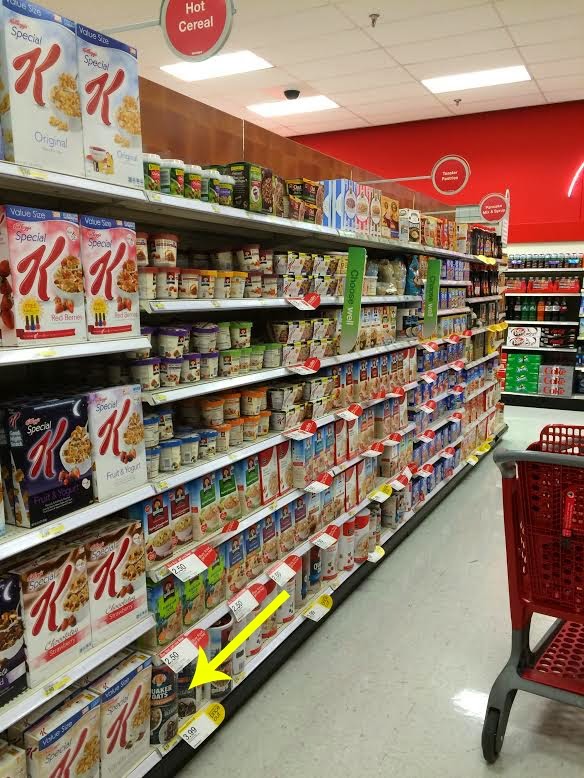
Where is `floor`? This screenshot has height=778, width=584. floor is located at coordinates (354, 747).